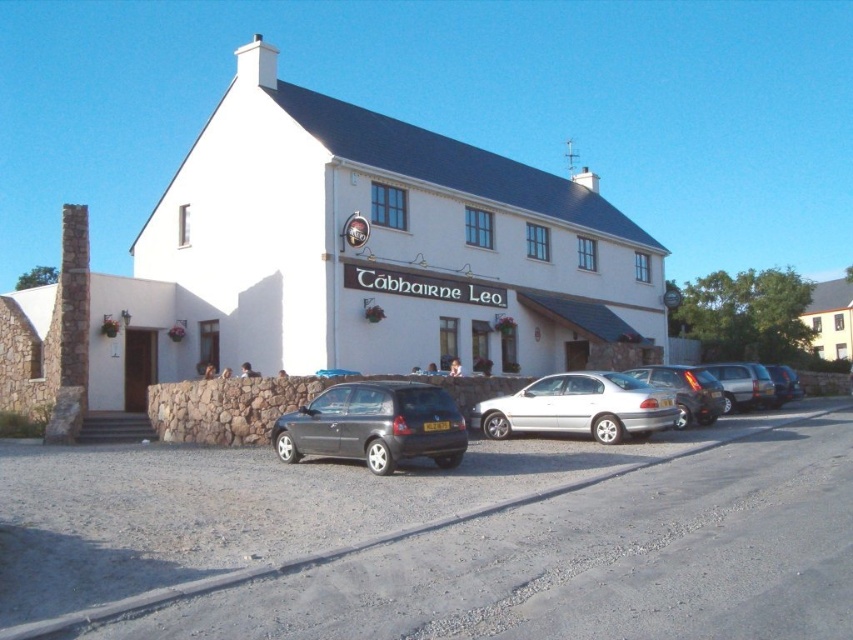
Looking at this image, you are driving a car and want to park it next to the white matte building at center. However, there is a silver metallic hatchback at right already parked there. Based on their positions, which vehicle is closer to the left side of the parking area?

The white matte building at center is positioned on the left side of silver metallic hatchback at right, so the white matte building at center is closer to the left side of the parking area.

You are a delivery driver approaching the Tabhairne Leo pub. You see a silver metallic car at center and a yellow matte building at upper right. Which object is narrower from your viewpoint?

The silver metallic car at center is thinner than the yellow matte building at upper right, so the silver metallic car at center is narrower from your viewpoint.

You are a delivery driver needing to park your vehicle near the entrance of the yellow matte building at upper right. Based on the scene, can you park the matte gray hatchback at center in a spot that is directly in front of the building?

The matte gray hatchback at center is below the yellow matte building at upper right, so it cannot be parked directly in front of the building since it is positioned lower in the scene.